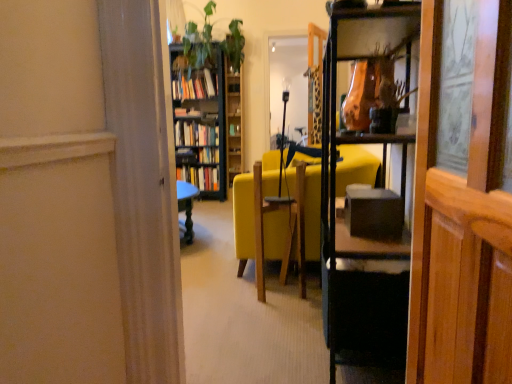
Question: Is hardcover books at center, which ranks as the first book in top-to-bottom order, not near wooden bookcase at center?

Choices:
 (A) no
 (B) yes

Answer: (A)

Question: From a real-world perspective, is hardcover books at center, which ranks as the first book in top-to-bottom order, positioned over wooden bookcase at center based on gravity?

Choices:
 (A) yes
 (B) no

Answer: (A)

Question: Can you confirm if hardcover books at center, which ranks as the first book in top-to-bottom order, is wider than wooden bookcase at center?

Choices:
 (A) yes
 (B) no

Answer: (B)

Question: Is wooden bookcase at center a part of hardcover books at center, which ranks as the 3th book in bottom-to-top order?

Choices:
 (A) no
 (B) yes

Answer: (A)

Question: Could you tell me if hardcover books at center, which ranks as the first book in top-to-bottom order, is facing wooden bookcase at center?

Choices:
 (A) no
 (B) yes

Answer: (B)

Question: In terms of size, does wooden bookcase at center appear bigger or smaller than yellow fabric chair at center?

Choices:
 (A) big
 (B) small

Answer: (B)

Question: From the image's perspective, is wooden bookcase at center located above or below yellow fabric chair at center?

Choices:
 (A) below
 (B) above

Answer: (B)

Question: Would you say wooden bookcase at center is inside or outside yellow fabric chair at center?

Choices:
 (A) outside
 (B) inside

Answer: (A)

Question: In the image, is wooden bookcase at center on the left side or the right side of yellow fabric chair at center?

Choices:
 (A) left
 (B) right

Answer: (A)

Question: Is hardcover books at center, which appears as the second book when ordered from the bottom, to the left or to the right of green leafy plant at upper center in the image?

Choices:
 (A) left
 (B) right

Answer: (A)

Question: In the image, is hardcover books at center, which appears as the second book when ordered from the bottom, positioned in front of or behind green leafy plant at upper center?

Choices:
 (A) front
 (B) behind

Answer: (B)

Question: From a real-world perspective, is hardcover books at center, the second book positioned from the top, above or below green leafy plant at upper center?

Choices:
 (A) below
 (B) above

Answer: (A)

Question: Do you think hardcover books at center, which appears as the second book when ordered from the bottom, is within green leafy plant at upper center, or outside of it?

Choices:
 (A) outside
 (B) inside

Answer: (A)

Question: From a real-world perspective, is wooden bookshelf at upper center physically located above or below hardcover book at center, marked as the 1th book in a bottom-to-top arrangement?

Choices:
 (A) below
 (B) above

Answer: (B)

Question: Considering the positions of wooden bookshelf at upper center and hardcover book at center, the third book positioned from the top, in the image, is wooden bookshelf at upper center taller or shorter than hardcover book at center, the third book positioned from the top,?

Choices:
 (A) tall
 (B) short

Answer: (A)